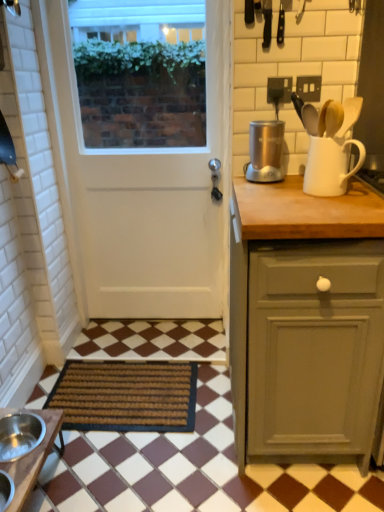
Question: Considering the relative positions of brown woven mat at lower left and white matte jug at upper right in the image provided, is brown woven mat at lower left to the left of white matte jug at upper right from the viewer's perspective?

Choices:
 (A) yes
 (B) no

Answer: (A)

Question: From a real-world perspective, does brown woven mat at lower left sit lower than white matte jug at upper right?

Choices:
 (A) no
 (B) yes

Answer: (B)

Question: Considering the relative sizes of brown woven mat at lower left and white matte jug at upper right in the image provided, is brown woven mat at lower left bigger than white matte jug at upper right?

Choices:
 (A) no
 (B) yes

Answer: (B)

Question: Is brown woven mat at lower left facing away from white matte jug at upper right?

Choices:
 (A) yes
 (B) no

Answer: (B)

Question: Can you confirm if brown woven mat at lower left is shorter than white matte jug at upper right?

Choices:
 (A) yes
 (B) no

Answer: (A)

Question: From a real-world perspective, is matte gray cabinet at right above or below brown wooden table at lower left?

Choices:
 (A) below
 (B) above

Answer: (B)

Question: Considering the positions of matte gray cabinet at right and brown wooden table at lower left in the image, is matte gray cabinet at right wider or thinner than brown wooden table at lower left?

Choices:
 (A) thin
 (B) wide

Answer: (B)

Question: Based on their positions, is matte gray cabinet at right located to the left or right of brown wooden table at lower left?

Choices:
 (A) left
 (B) right

Answer: (B)

Question: Considering the positions of point (266, 444) and point (1, 410), is point (266, 444) closer or farther from the camera than point (1, 410)?

Choices:
 (A) closer
 (B) farther

Answer: (A)

Question: Choose the correct answer: Is satin silver appliance at upper right inside brown wooden table at lower left or outside it?

Choices:
 (A) inside
 (B) outside

Answer: (B)

Question: From a real-world perspective, is satin silver appliance at upper right positioned above or below brown wooden table at lower left?

Choices:
 (A) above
 (B) below

Answer: (A)

Question: Is point (261, 173) closer or farther from the camera than point (41, 452)?

Choices:
 (A) closer
 (B) farther

Answer: (B)

Question: Is satin silver appliance at upper right in front of or behind brown wooden table at lower left in the image?

Choices:
 (A) behind
 (B) front

Answer: (A)

Question: From the image's perspective, is white matte door at center above or below matte gray cabinet at right?

Choices:
 (A) above
 (B) below

Answer: (A)

Question: Would you say white matte door at center is inside or outside matte gray cabinet at right?

Choices:
 (A) inside
 (B) outside

Answer: (B)